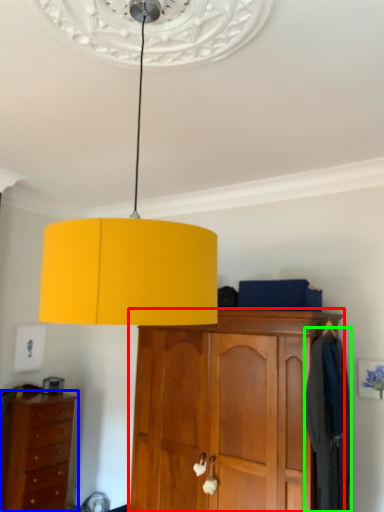
Question: Which object is the closest to the cabinetry (highlighted by a red box)? Choose among these: chest of drawers (highlighted by a blue box) or clothing (highlighted by a green box).

Choices:
 (A) chest of drawers
 (B) clothing

Answer: (B)